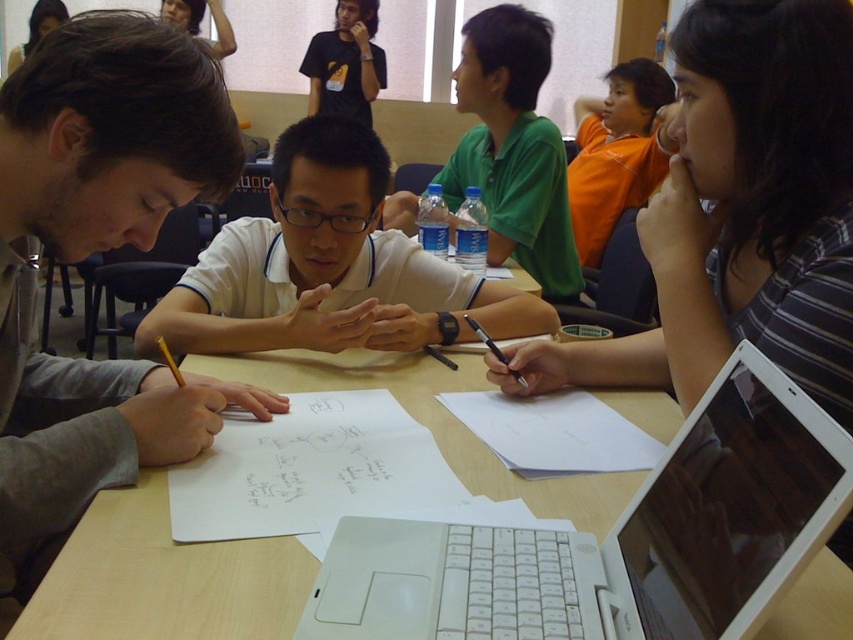
Question: Which of the following is the farthest from the observer?

Choices:
 (A) matte black t-shirt at upper center
 (B) white matte shirt at center
 (C) green matte shirt at center
 (D) white paper at center

Answer: (A)

Question: Can you confirm if gray fabric shirt at left is bigger than orange cotton shirt at upper center?

Choices:
 (A) no
 (B) yes

Answer: (A)

Question: Is gray fabric shirt at left above white paper at center?

Choices:
 (A) yes
 (B) no

Answer: (A)

Question: Estimate the real-world distances between objects in this image. Which object is closer to the matte black hair at upper left?

Choices:
 (A) gray fabric shirt at left
 (B) white plastic laptop at center
 (C) matte black t-shirt at upper center

Answer: (C)

Question: Is the position of white matte shirt at center more distant than that of green matte shirt at center?

Choices:
 (A) no
 (B) yes

Answer: (A)

Question: Among these points, which one is farthest from the camera?

Choices:
 (A) (595, 132)
 (B) (7, 74)
 (C) (495, 349)
 (D) (370, 60)

Answer: (D)